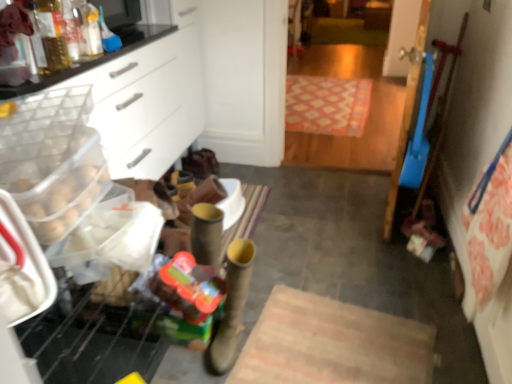
Where is `vacant point to the left of leather boot at center`? The width and height of the screenshot is (512, 384). vacant point to the left of leather boot at center is located at coordinates (180, 364).